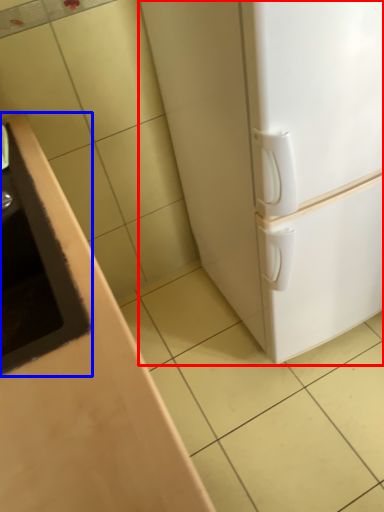
Question: Among these objects, which one is farthest to the camera, refrigerator (highlighted by a red box) or sink (highlighted by a blue box)?

Choices:
 (A) refrigerator
 (B) sink

Answer: (A)